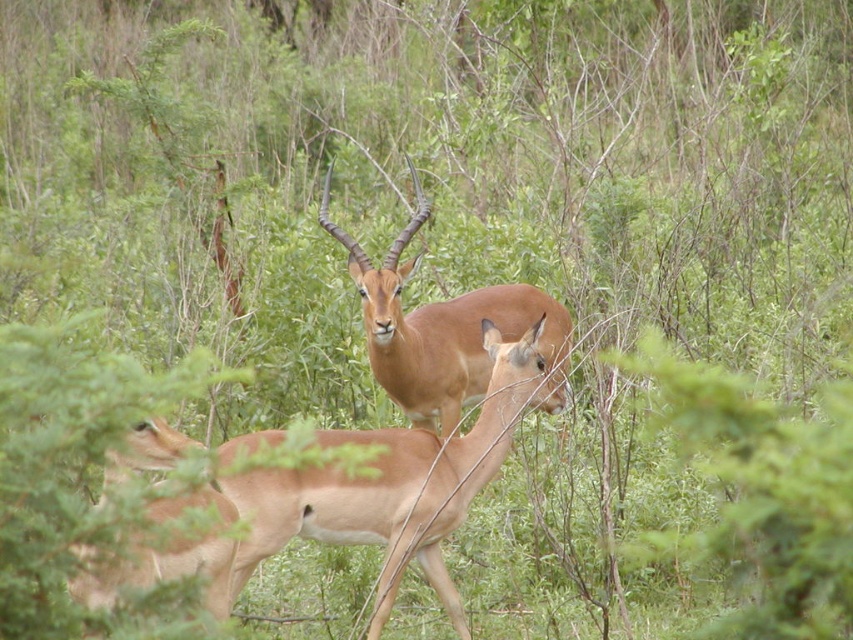
Who is taller, light brown fur at center or light brown fur antelope at center?

Standing taller between the two is light brown fur at center.

Is point (389, 525) positioned behind point (164, 572)?

That is True.

You are a GUI agent. You are given a task and a screenshot of the screen. Output one action in this format:
    pyautogui.click(x=<x>, y=<y>)
    Task: Click on the light brown fur at center
    
    Given the screenshot: What is the action you would take?
    pyautogui.click(x=395, y=484)

Is light brown fur at center to the right of brown matte/deer at center from the viewer's perspective?

In fact, light brown fur at center is to the left of brown matte/deer at center.

Is light brown fur at center closer to the viewer compared to brown matte/deer at center?

Yes, light brown fur at center is closer to the viewer.

Which is behind, point (299, 529) or point (520, 304)?

Point (520, 304)

I want to click on light brown fur at center, so tap(395, 484).

This screenshot has height=640, width=853. What do you see at coordinates (439, 326) in the screenshot?
I see `brown matte/deer at center` at bounding box center [439, 326].

The width and height of the screenshot is (853, 640). What do you see at coordinates (439, 326) in the screenshot? I see `brown matte/deer at center` at bounding box center [439, 326].

Find the location of a particular element. The height and width of the screenshot is (640, 853). brown matte/deer at center is located at coordinates (439, 326).